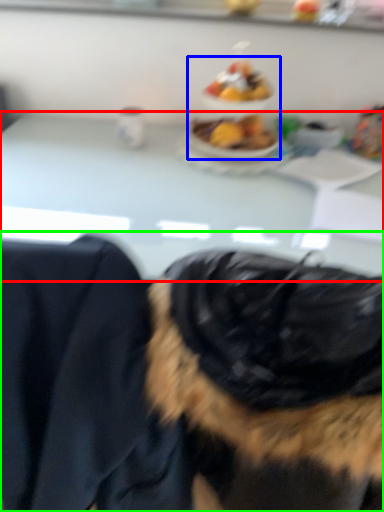
Question: Which object is positioned farthest from table (highlighted by a red box)? Select from food (highlighted by a blue box) and dog (highlighted by a green box).

Choices:
 (A) food
 (B) dog

Answer: (B)